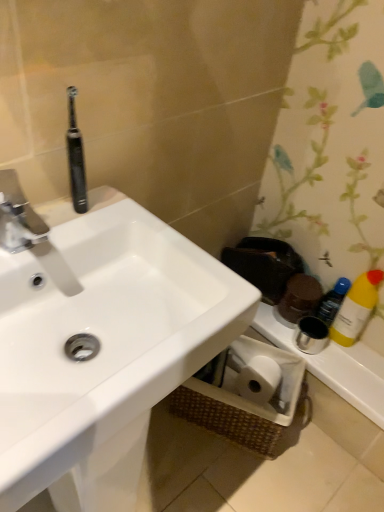
This screenshot has height=512, width=384. Find the location of `free space to the right of black rubber toothbrush at upper left`. free space to the right of black rubber toothbrush at upper left is located at coordinates (139, 223).